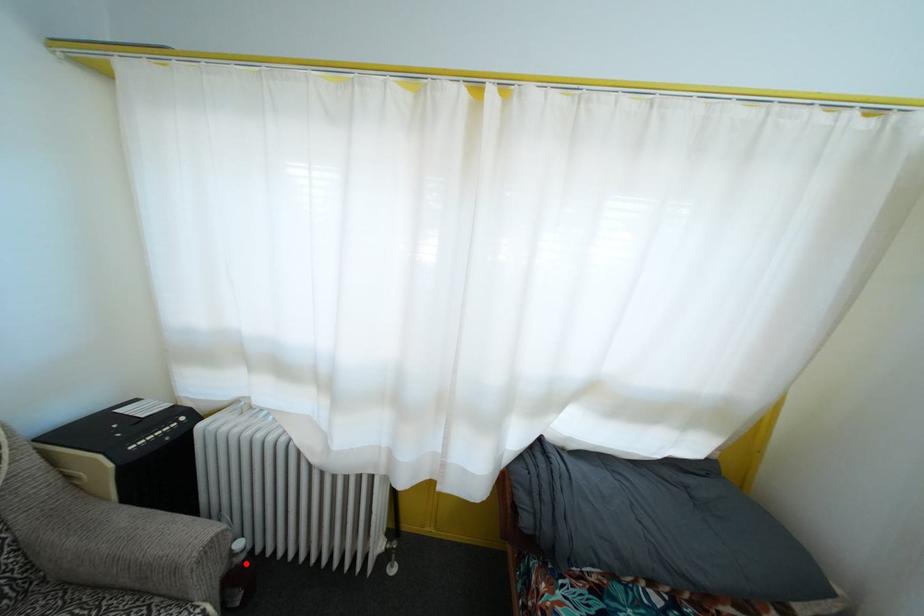
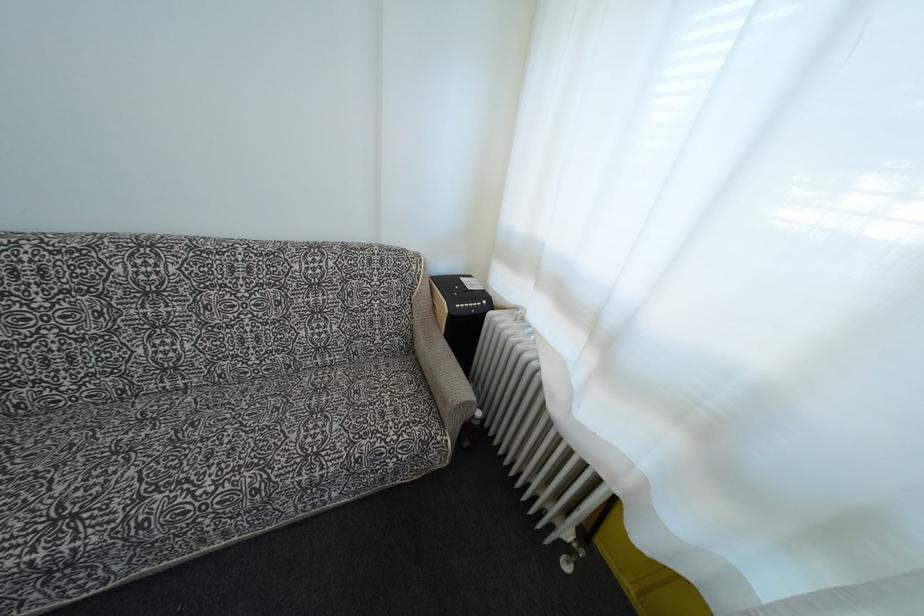
Question: I am providing you with two images of the same scene from different viewpoints. Given a red point in image1, look at the same physical point in image2. Is it:

Choices:
 (A) Closer to the viewpoint
 (B) Farther from the viewpoint

Answer: (B)